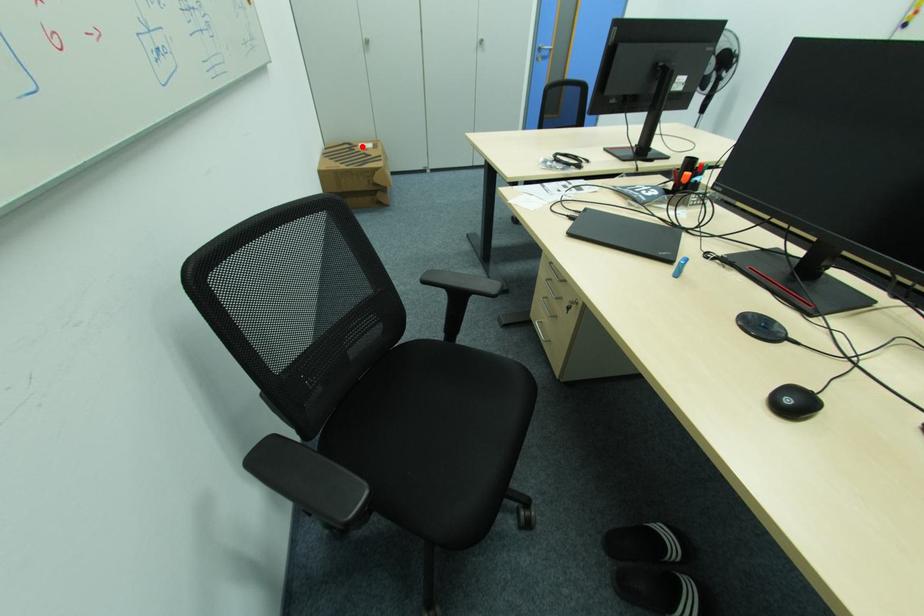
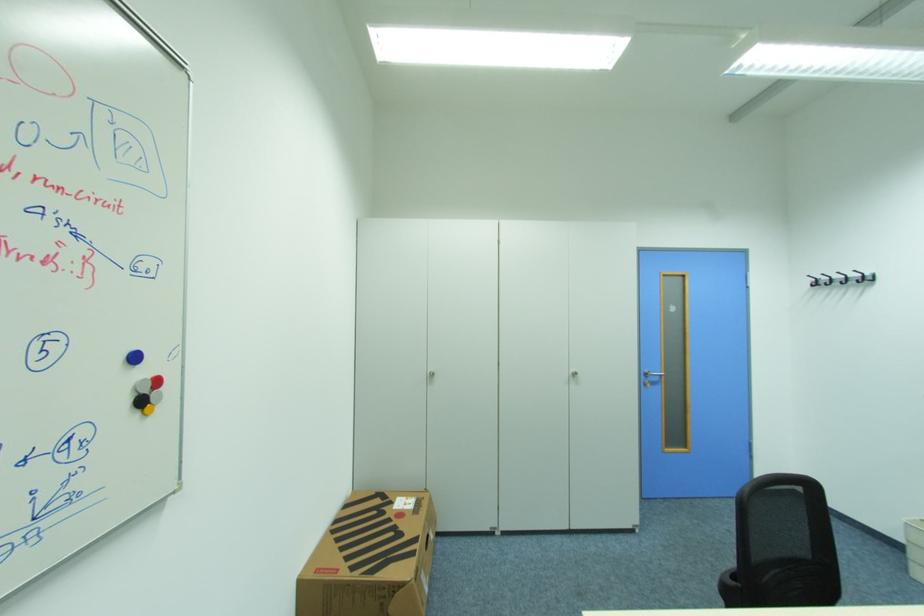
In the second image, find the point that corresponds to the highlighted location in the first image.

(396, 503)